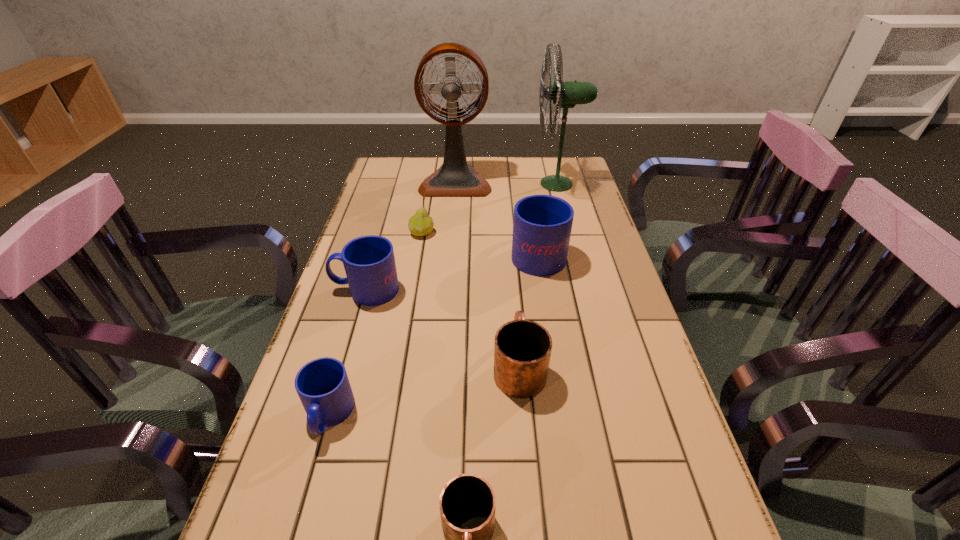
The height and width of the screenshot is (540, 960). What are the coordinates of `blank space located 0.050m on the side with the handle of the nearest blue mug` in the screenshot? It's located at click(313, 471).

The width and height of the screenshot is (960, 540). I want to click on fan present at the right edge, so click(x=565, y=94).

The height and width of the screenshot is (540, 960). What are the coordinates of `mug located in the right edge section of the desktop` in the screenshot? It's located at (542, 224).

Identify the location of object at the far right corner. The height and width of the screenshot is (540, 960). pos(565,94).

In the image, there is a desktop. At what (x,y) coordinates should I click in order to perform the action: click on free space at the far edge. Please return your answer as a coordinate pair (x, y). The image size is (960, 540). Looking at the image, I should click on (x=493, y=175).

Where is `vacant space at the left edge`? The image size is (960, 540). vacant space at the left edge is located at coordinates (385, 194).

Where is `blank space at the right edge of the desktop`? blank space at the right edge of the desktop is located at coordinates (575, 241).

The image size is (960, 540). Find the location of `vacant space at the far left corner of the desktop`. vacant space at the far left corner of the desktop is located at coordinates (414, 170).

The height and width of the screenshot is (540, 960). In order to click on vacant space at the far right corner of the desktop in this screenshot , I will do `click(565, 163)`.

Image resolution: width=960 pixels, height=540 pixels. What are the coordinates of `free spot between the nearest blue mug and the second smallest blue mug` in the screenshot? It's located at click(x=348, y=352).